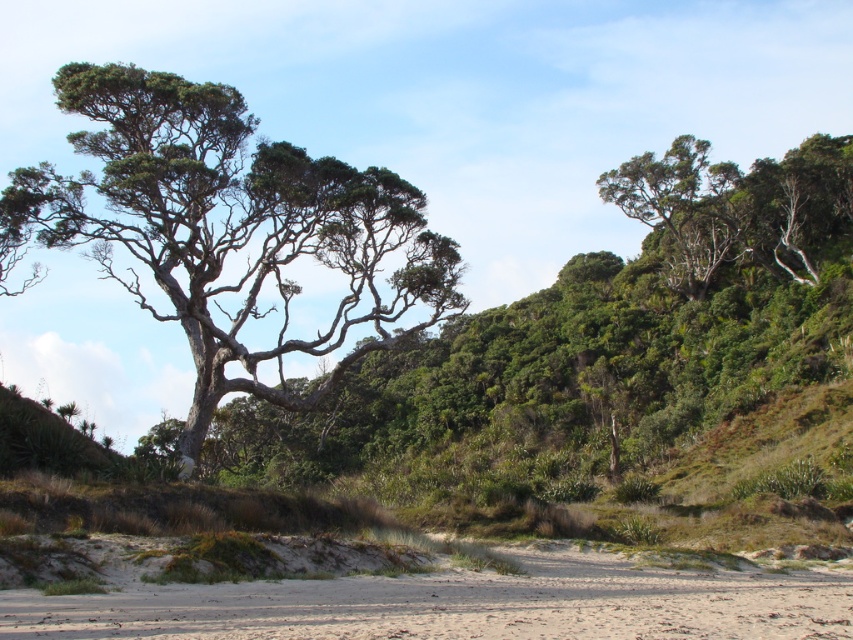
Question: Is smooth gray bark tree at center smaller than light brown sandy beach at lower center?

Choices:
 (A) yes
 (B) no

Answer: (B)

Question: Considering the real-world distances, which object is farthest from the light brown sandy beach at lower center?

Choices:
 (A) smooth gray bark tree at center
 (B) green leafy tree at upper right

Answer: (B)

Question: Is smooth gray bark tree at center thinner than green leafy tree at upper right?

Choices:
 (A) yes
 (B) no

Answer: (B)

Question: Which of these objects is positioned closest to the smooth gray bark tree at center?

Choices:
 (A) green leafy tree at upper right
 (B) light brown sandy beach at lower center

Answer: (B)

Question: Which of these objects is positioned farthest from the green leafy tree at upper right?

Choices:
 (A) smooth gray bark tree at center
 (B) light brown sandy beach at lower center

Answer: (B)

Question: Does light brown sandy beach at lower center appear under green leafy tree at upper right?

Choices:
 (A) yes
 (B) no

Answer: (A)